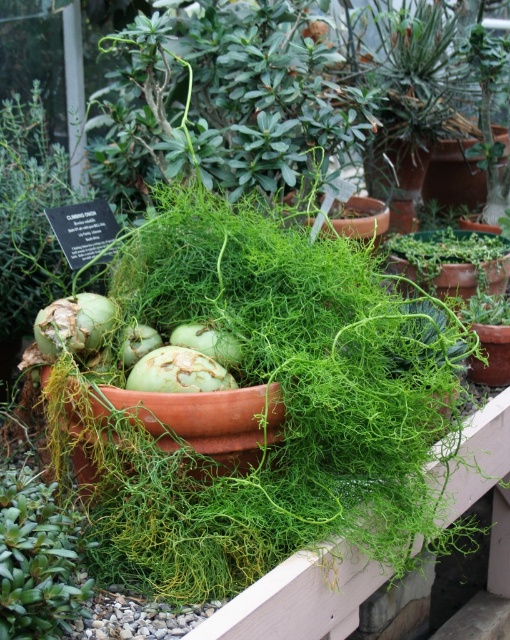
You are a gardener who needs to determine which plant is taller between the green matte succulent at lower left and the green matte coconut at center. Based on the scene, which one should you choose?

The green matte succulent at lower left is much taller than the green matte coconut at center, so you should choose the green matte succulent at lower left.

You are a gardener trying to determine which plant has a wider base. You see the green matte vegetable at center and the green matte fennel bulb at center. Which one has a wider base?

The green matte vegetable at center has a wider base than the green matte fennel bulb at center because its width surpasses that of the green matte fennel bulb at center.